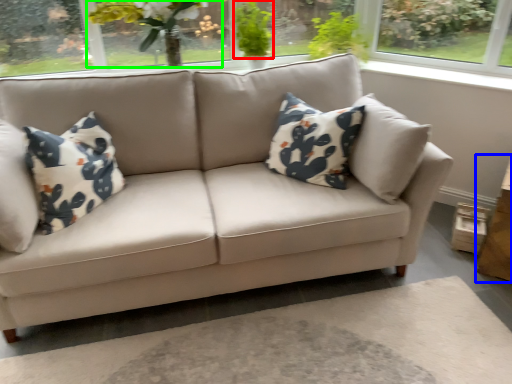
Question: Based on their relative distances, which object is nearer to plant (highlighted by a red box)? Choose from table (highlighted by a blue box) and floral arrangement (highlighted by a green box).

Choices:
 (A) table
 (B) floral arrangement

Answer: (B)